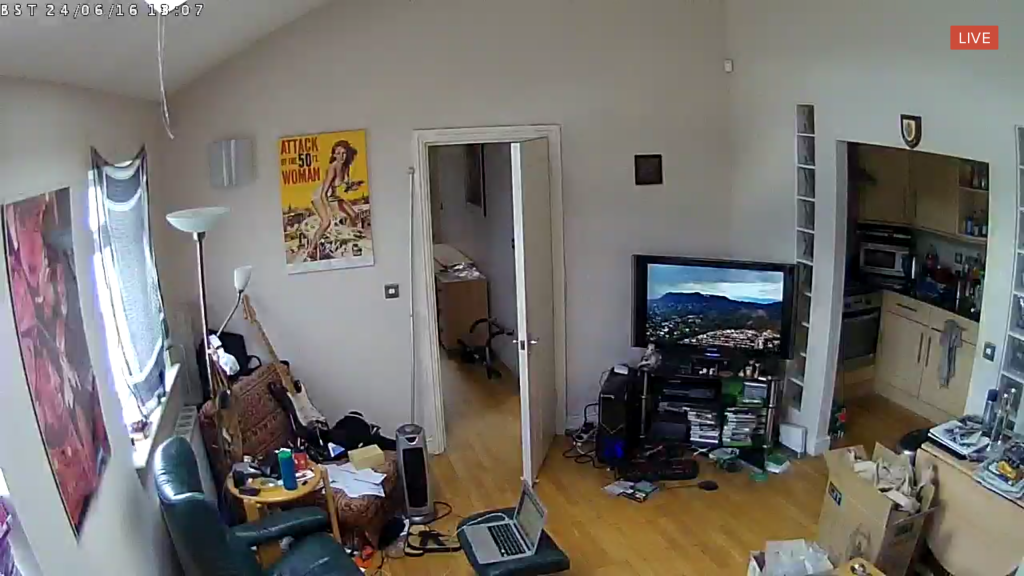
Locate an element on the screen. This screenshot has width=1024, height=576. tapestry is located at coordinates (140, 289).